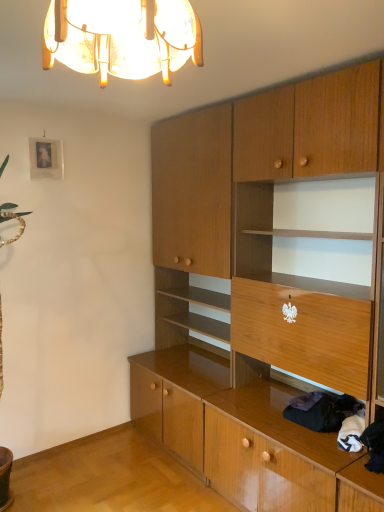
Question: Is wooden cabinet at center to the left or to the right of dark woolen sweater at lower right in the image?

Choices:
 (A) right
 (B) left

Answer: (B)

Question: From a real-world perspective, is wooden cabinet at center positioned above or below dark woolen sweater at lower right?

Choices:
 (A) above
 (B) below

Answer: (A)

Question: Which is farther from the matte silver picture frame at upper left?

Choices:
 (A) translucent glass chandelier at upper center
 (B) wooden cabinet at center
 (C) dark woolen sweater at lower right

Answer: (C)

Question: Which of these objects is positioned closest to the dark woolen sweater at lower right?

Choices:
 (A) translucent glass chandelier at upper center
 (B) wooden cabinet at center
 (C) matte silver picture frame at upper left

Answer: (B)